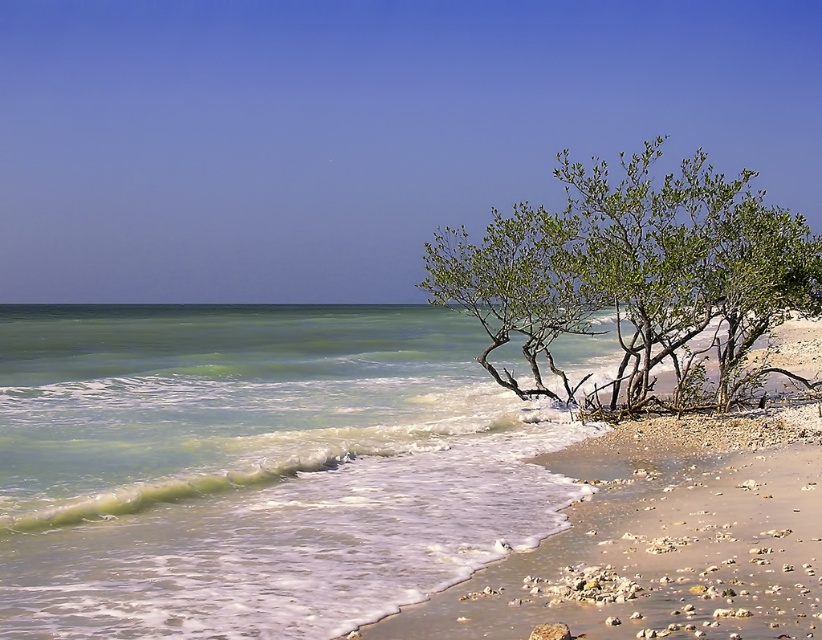
Does green translucent water at lower left appear over green leafy shrub at right?

Incorrect, green translucent water at lower left is not positioned above green leafy shrub at right.

Is point (257, 416) closer to camera compared to point (520, 211)?

Yes, point (257, 416) is closer to viewer.

At what (x,y) coordinates should I click in order to perform the action: click on green translucent water at lower left. Please return your answer as a coordinate pair (x, y). The image size is (822, 640). Looking at the image, I should click on (254, 467).